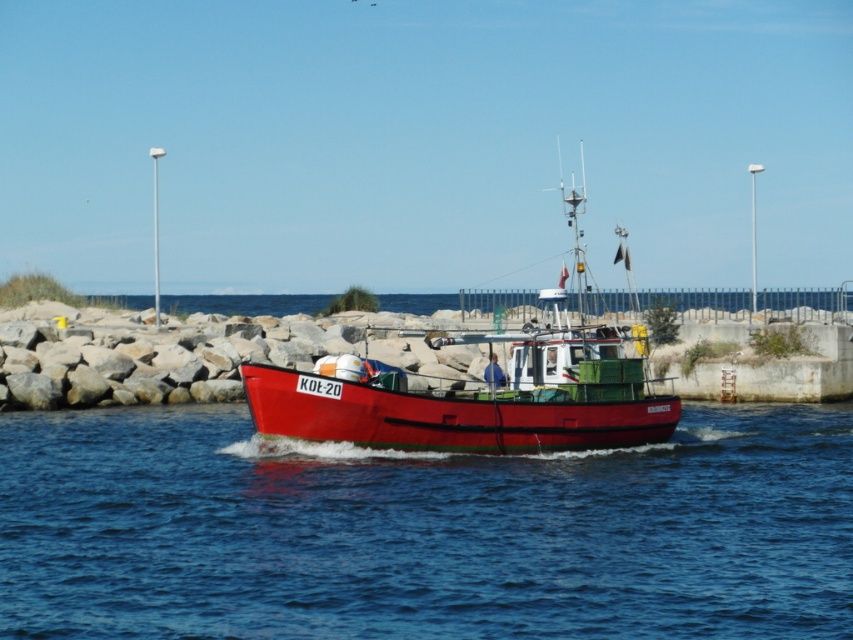
Question: Can you confirm if blue water at center is wider than shiny red boat at center?

Choices:
 (A) no
 (B) yes

Answer: (B)

Question: Can you confirm if blue water at center is wider than shiny red boat at center?

Choices:
 (A) no
 (B) yes

Answer: (B)

Question: Which of the following is the farthest from the observer?

Choices:
 (A) (192, 477)
 (B) (618, 416)

Answer: (B)

Question: Is blue water at center in front of shiny red boat at center?

Choices:
 (A) yes
 (B) no

Answer: (A)